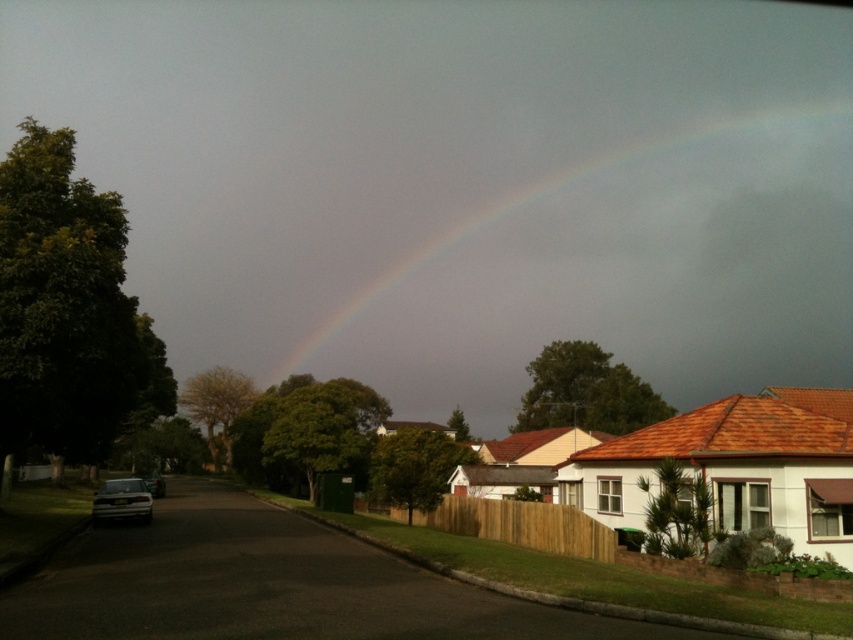
Which is more to the left, matte silver sedan at lower left or silver metallic car at lower left?

From the viewer's perspective, silver metallic car at lower left appears more on the left side.

Between point (112, 506) and point (161, 496), which one is positioned in front?

Point (112, 506) is more forward.

Locate an element on the screen. This screenshot has width=853, height=640. matte silver sedan at lower left is located at coordinates (120, 500).

Which is below, rainbow at upper center or matte silver sedan at lower left?

matte silver sedan at lower left is lower down.

The height and width of the screenshot is (640, 853). Describe the element at coordinates (624, 269) in the screenshot. I see `rainbow at upper center` at that location.

Where is `rainbow at upper center`? rainbow at upper center is located at coordinates (624, 269).

Describe the element at coordinates (624, 269) in the screenshot. The width and height of the screenshot is (853, 640). I see `rainbow at upper center` at that location.

Is rainbow at upper center above silver metallic car at lower left?

Yes.

Describe the element at coordinates (624, 269) in the screenshot. I see `rainbow at upper center` at that location.

This screenshot has height=640, width=853. What are the coordinates of `rainbow at upper center` in the screenshot? It's located at (624, 269).